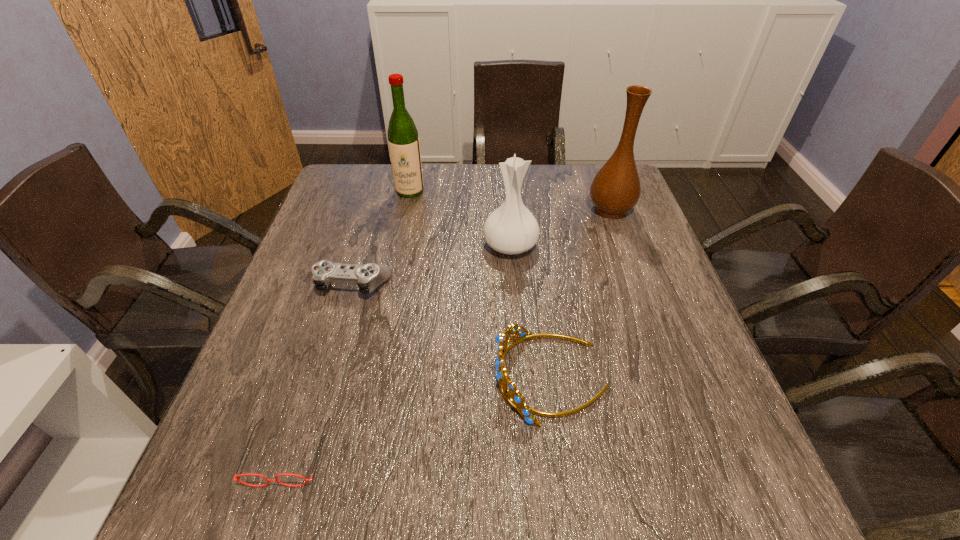
At what (x,y) coordinates should I click in order to perform the action: click on the rightmost object. Please return your answer as a coordinate pair (x, y). Looking at the image, I should click on 616,189.

You are a GUI agent. You are given a task and a screenshot of the screen. Output one action in this format:
    pyautogui.click(x=<x>, y=<y>)
    Task: Click on the farther vase
    Image resolution: width=960 pixels, height=540 pixels.
    Given the screenshot: What is the action you would take?
    tap(616, 189)

Where is `liquor`? The width and height of the screenshot is (960, 540). liquor is located at coordinates (403, 140).

I want to click on the left vase, so click(511, 229).

The image size is (960, 540). I want to click on the fourth nearest object, so click(511, 229).

What are the coordinates of `the third shortest object` in the screenshot? It's located at (513, 397).

You are a GUI agent. You are given a task and a screenshot of the screen. Output one action in this format:
    pyautogui.click(x=<x>, y=<y>)
    Task: Click on the fourth farthest object
    
    Given the screenshot: What is the action you would take?
    pyautogui.click(x=368, y=277)

This screenshot has width=960, height=540. What are the coordinates of `control` in the screenshot? It's located at (368, 277).

In order to click on the shortest object in this screenshot , I will do `click(268, 480)`.

Find the location of a particular element. The width and height of the screenshot is (960, 540). free space located on the left of the farther vase is located at coordinates (472, 210).